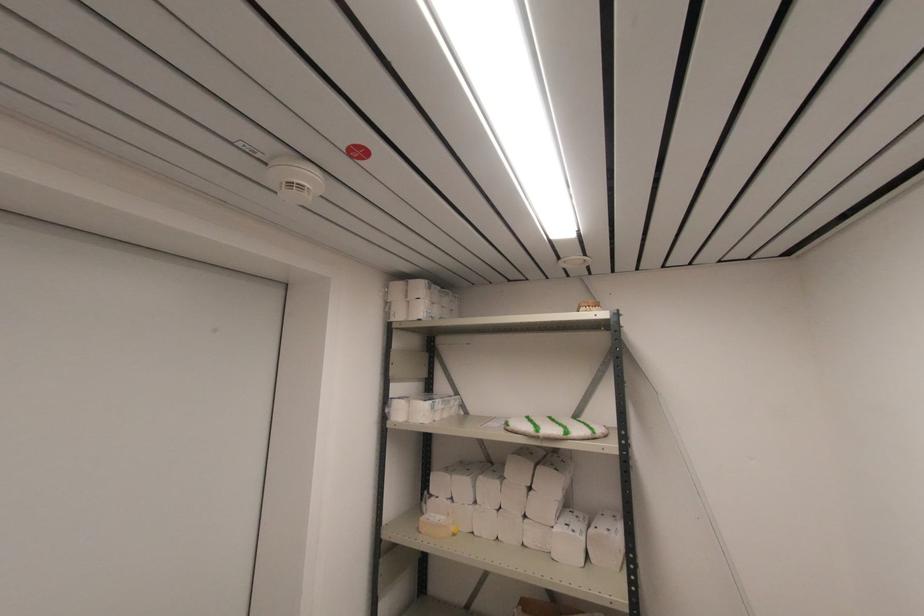
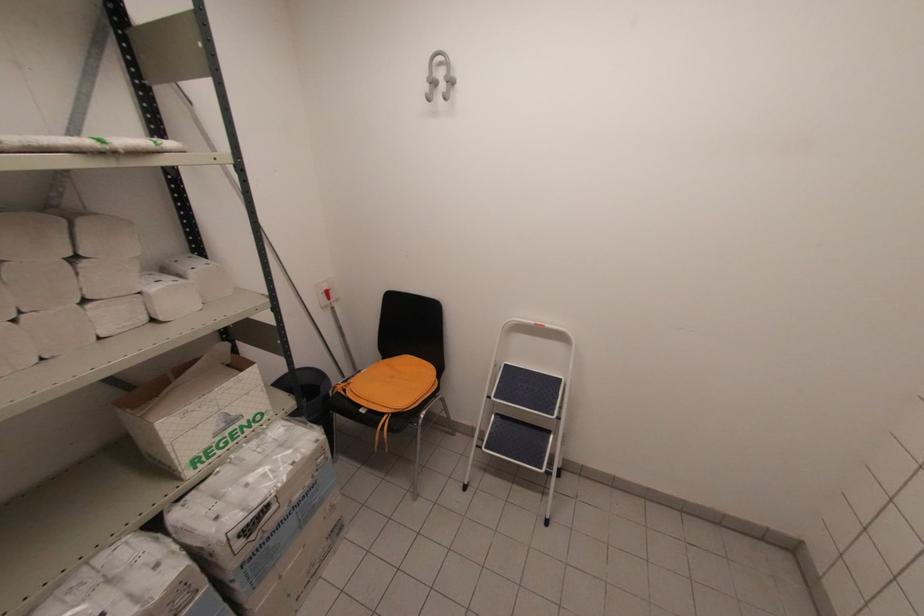
In the second image, find the point that corresponds to the point at 533,488 in the first image.

(81, 254)